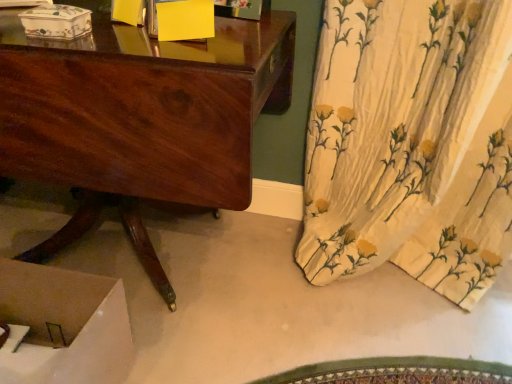
What do you see at coordinates (56, 22) in the screenshot?
I see `porcelain floral box at upper left, which appears as the third box when viewed from the right` at bounding box center [56, 22].

Locate an element on the screen. Image resolution: width=512 pixels, height=384 pixels. shiny brown wood desk at center is located at coordinates (140, 119).

Locate an element on the screen. The width and height of the screenshot is (512, 384). yellow paper at upper center, the second box from the left is located at coordinates (128, 12).

Does yellow paper at upper center, the second box from the left, appear on the right side of porcelain floral box at upper left, the first box positioned from the left?

Correct, you'll find yellow paper at upper center, the second box from the left, to the right of porcelain floral box at upper left, the first box positioned from the left.

In the scene shown: Is yellow paper at upper center, the second box from the left, shorter than porcelain floral box at upper left, which appears as the third box when viewed from the right?

Incorrect, the height of yellow paper at upper center, the second box from the left, does not fall short of that of porcelain floral box at upper left, which appears as the third box when viewed from the right.

How many degrees apart are the facing directions of yellow paper at upper center, the second box from the left, and porcelain floral box at upper left, which appears as the third box when viewed from the right?

The angular difference between yellow paper at upper center, the second box from the left, and porcelain floral box at upper left, which appears as the third box when viewed from the right, is 14.4 degrees.

From the image's perspective, between shiny brown wood desk at center and porcelain floral box at upper left, the first box positioned from the left, who is located below?

shiny brown wood desk at center, from the image's perspective.

From a real-world perspective, is shiny brown wood desk at center positioned above or below porcelain floral box at upper left, the first box positioned from the left?

shiny brown wood desk at center is below porcelain floral box at upper left, the first box positioned from the left.

Could porcelain floral box at upper left, which appears as the third box when viewed from the right, be considered to be inside shiny brown wood desk at center?

Yes, porcelain floral box at upper left, which appears as the third box when viewed from the right, is inside shiny brown wood desk at center.

Is shiny brown wood desk at center in contact with porcelain floral box at upper left, the first box positioned from the left?

No, shiny brown wood desk at center is not next to porcelain floral box at upper left, the first box positioned from the left.

Considering the sizes of objects yellow paper at upper center, the second box from the left, and yellow paper at upper center, placed as the 3th box when sorted from left to right, in the image provided, who is wider, yellow paper at upper center, the second box from the left, or yellow paper at upper center, placed as the 3th box when sorted from left to right,?

yellow paper at upper center, placed as the 3th box when sorted from left to right.

From a real-world perspective, is yellow paper at upper center, the second box from the left, positioned above or below yellow paper at upper center, which is counted as the first box, starting from the right?

yellow paper at upper center, the second box from the left, is situated higher than yellow paper at upper center, which is counted as the first box, starting from the right, in the real world.

Is yellow paper at upper center, which appears as the second box when viewed from the right, oriented away from yellow paper at upper center, which is counted as the first box, starting from the right?

No, yellow paper at upper center, which is counted as the first box, starting from the right, is not at the back of yellow paper at upper center, which appears as the second box when viewed from the right.

Is yellow paper at upper center, which is counted as the first box, starting from the right, a part of yellow paper at upper center, the second box from the left?

No, yellow paper at upper center, which is counted as the first box, starting from the right, is not a part of yellow paper at upper center, the second box from the left.

Is yellow paper at upper center, which appears as the second box when viewed from the right, positioned with its back to shiny brown wood desk at center?

That's not correct — yellow paper at upper center, which appears as the second box when viewed from the right, is not looking away from shiny brown wood desk at center.

How different are the orientations of yellow paper at upper center, the second box from the left, and shiny brown wood desk at center in degrees?

14 degrees.

Looking at this image, from the image's perspective, which is below, yellow paper at upper center, the second box from the left, or shiny brown wood desk at center?

shiny brown wood desk at center.

Is shiny brown wood desk at center further to camera compared to yellow paper at upper center, which is counted as the first box, starting from the right?

That is False.

From the image's perspective, which one is positioned lower, shiny brown wood desk at center or yellow paper at upper center, placed as the 3th box when sorted from left to right?

shiny brown wood desk at center, from the image's perspective.

Is shiny brown wood desk at center far away from yellow paper at upper center, placed as the 3th box when sorted from left to right?

That's not correct — shiny brown wood desk at center is a little close to yellow paper at upper center, placed as the 3th box when sorted from left to right.

From a real-world perspective, is shiny brown wood desk at center located higher than yellow paper at upper center, placed as the 3th box when sorted from left to right?

Incorrect, from a real-world perspective, shiny brown wood desk at center is lower than yellow paper at upper center, placed as the 3th box when sorted from left to right.

Can you confirm if porcelain floral box at upper left, the first box positioned from the left, is positioned to the right of shiny brown wood desk at center?

Yes, porcelain floral box at upper left, the first box positioned from the left, is to the right of shiny brown wood desk at center.

Considering the sizes of porcelain floral box at upper left, which appears as the third box when viewed from the right, and shiny brown wood desk at center in the image, is porcelain floral box at upper left, which appears as the third box when viewed from the right, bigger or smaller than shiny brown wood desk at center?

Clearly, porcelain floral box at upper left, which appears as the third box when viewed from the right, is smaller in size than shiny brown wood desk at center.

Are porcelain floral box at upper left, which appears as the third box when viewed from the right, and shiny brown wood desk at center located far from each other?

No, porcelain floral box at upper left, which appears as the third box when viewed from the right, is not far away from shiny brown wood desk at center.

From a real-world perspective, between porcelain floral box at upper left, which appears as the third box when viewed from the right, and shiny brown wood desk at center, who is vertically lower?

shiny brown wood desk at center, from a real-world perspective.

Which object is wider, yellow paper at upper center, which is counted as the first box, starting from the right, or shiny brown wood desk at center?

With larger width is shiny brown wood desk at center.

Could shiny brown wood desk at center be considered to be inside yellow paper at upper center, placed as the 3th box when sorted from left to right?

No, shiny brown wood desk at center is located outside of yellow paper at upper center, placed as the 3th box when sorted from left to right.

How far apart are yellow paper at upper center, placed as the 3th box when sorted from left to right, and shiny brown wood desk at center?

yellow paper at upper center, placed as the 3th box when sorted from left to right, and shiny brown wood desk at center are 8.63 inches apart from each other.

Identify the location of box that is on the left side of yellow paper at upper center, which appears as the second box when viewed from the right. The height and width of the screenshot is (384, 512). (56, 22).

Starting from the shiny brown wood desk at center, which box is the 1st one to the right? Please provide its 2D coordinates.

[(56, 22)]

When comparing their distances from yellow paper at upper center, placed as the 3th box when sorted from left to right, does shiny brown wood desk at center or porcelain floral box at upper left, the first box positioned from the left, seem further?

shiny brown wood desk at center.

Which object lies further to the anchor point yellow paper at upper center, which appears as the second box when viewed from the right, yellow paper at upper center, which is counted as the first box, starting from the right, or porcelain floral box at upper left, which appears as the third box when viewed from the right?

porcelain floral box at upper left, which appears as the third box when viewed from the right, is further to yellow paper at upper center, which appears as the second box when viewed from the right.

From the image, which object appears to be nearer to porcelain floral box at upper left, the first box positioned from the left, shiny brown wood desk at center or yellow paper at upper center, which is counted as the first box, starting from the right?

Based on the image, yellow paper at upper center, which is counted as the first box, starting from the right, appears to be nearer to porcelain floral box at upper left, the first box positioned from the left.

Based on the photo, from the image, which object appears to be nearer to yellow paper at upper center, the second box from the left, yellow paper at upper center, which is counted as the first box, starting from the right, or shiny brown wood desk at center?

Based on the image, yellow paper at upper center, which is counted as the first box, starting from the right, appears to be nearer to yellow paper at upper center, the second box from the left.

Based on their spatial positions, is porcelain floral box at upper left, which appears as the third box when viewed from the right, or yellow paper at upper center, which is counted as the first box, starting from the right, closer to shiny brown wood desk at center?

yellow paper at upper center, which is counted as the first box, starting from the right, lies closer to shiny brown wood desk at center than the other object.

From the image, which object appears to be farther from yellow paper at upper center, the second box from the left, porcelain floral box at upper left, the first box positioned from the left, or yellow paper at upper center, which is counted as the first box, starting from the right?

The object further to yellow paper at upper center, the second box from the left, is porcelain floral box at upper left, the first box positioned from the left.

Looking at this image, estimate the real-world distances between objects in this image. Which object is closer to shiny brown wood desk at center, yellow paper at upper center, placed as the 3th box when sorted from left to right, or yellow paper at upper center, which appears as the second box when viewed from the right?

The object closer to shiny brown wood desk at center is yellow paper at upper center, placed as the 3th box when sorted from left to right.

When comparing their distances from shiny brown wood desk at center, does yellow paper at upper center, which appears as the second box when viewed from the right, or porcelain floral box at upper left, the first box positioned from the left, seem closer?

The object closer to shiny brown wood desk at center is porcelain floral box at upper left, the first box positioned from the left.

The height and width of the screenshot is (384, 512). I want to click on box between porcelain floral box at upper left, the first box positioned from the left, and yellow paper at upper center, which is counted as the first box, starting from the right, from left to right, so 128,12.